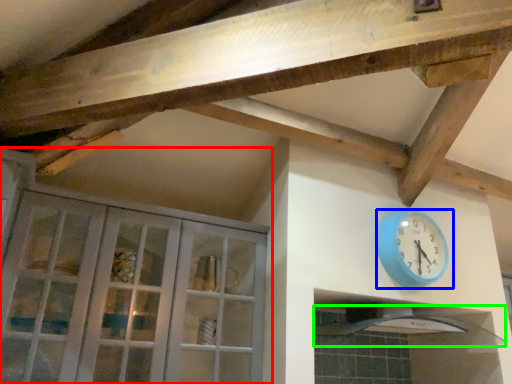
Question: Based on their relative distances, which object is nearer to cabinetry (highlighted by a red box)? Choose from wall clock (highlighted by a blue box) and exhaust hood (highlighted by a green box).

Choices:
 (A) wall clock
 (B) exhaust hood

Answer: (A)